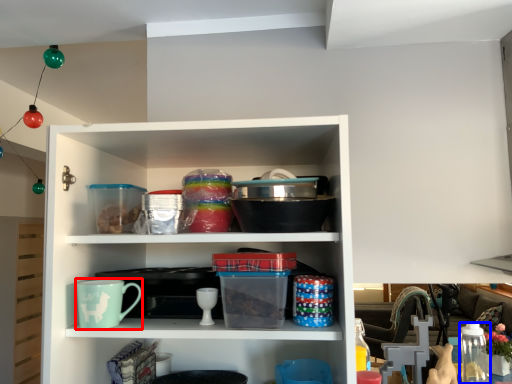
Question: Among these objects, which one is nearest to the camera, mug (highlighted by a red box) or glass jar (highlighted by a blue box)?

Choices:
 (A) mug
 (B) glass jar

Answer: (A)